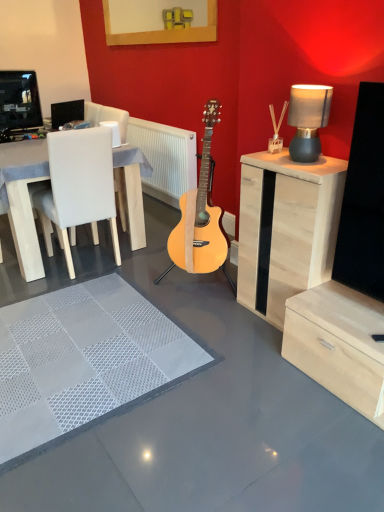
Question: Is white textured rug at center positioned with its back to black plastic speaker at upper left?

Choices:
 (A) no
 (B) yes

Answer: (A)

Question: Can you confirm if white textured rug at center is shorter than black plastic speaker at upper left?

Choices:
 (A) yes
 (B) no

Answer: (A)

Question: From the image's perspective, is white textured rug at center under black plastic speaker at upper left?

Choices:
 (A) yes
 (B) no

Answer: (A)

Question: From a real-world perspective, is white textured rug at center positioned under black plastic speaker at upper left based on gravity?

Choices:
 (A) no
 (B) yes

Answer: (B)

Question: Is white textured rug at center behind black plastic speaker at upper left?

Choices:
 (A) no
 (B) yes

Answer: (A)

Question: Looking at their shapes, would you say wooden picture frame at upper center is wider or thinner than white leather chair at left?

Choices:
 (A) wide
 (B) thin

Answer: (B)

Question: From a real-world perspective, is wooden picture frame at upper center positioned above or below white leather chair at left?

Choices:
 (A) below
 (B) above

Answer: (B)

Question: Visually, is wooden picture frame at upper center positioned to the left or to the right of white leather chair at left?

Choices:
 (A) right
 (B) left

Answer: (A)

Question: From the image's perspective, is wooden picture frame at upper center located above or below white leather chair at left?

Choices:
 (A) above
 (B) below

Answer: (A)

Question: Is light wood cabinet at right spatially inside white textured rug at center, or outside of it?

Choices:
 (A) inside
 (B) outside

Answer: (B)

Question: Does point (269, 194) appear closer or farther from the camera than point (129, 333)?

Choices:
 (A) closer
 (B) farther

Answer: (A)

Question: Is light wood cabinet at right bigger or smaller than white textured rug at center?

Choices:
 (A) small
 (B) big

Answer: (B)

Question: From the image's perspective, relative to white textured rug at center, is light wood cabinet at right above or below?

Choices:
 (A) below
 (B) above

Answer: (B)

Question: Considering the relative positions of white textured rug at center and white textured radiator at center in the image provided, is white textured rug at center to the left or to the right of white textured radiator at center?

Choices:
 (A) left
 (B) right

Answer: (A)

Question: Relative to white textured radiator at center, is white textured rug at center in front or behind?

Choices:
 (A) behind
 (B) front

Answer: (B)